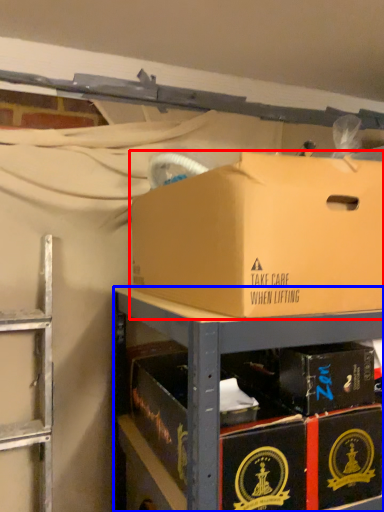
Question: Which object is closer to the camera taking this photo, box (highlighted by a red box) or shelf (highlighted by a blue box)?

Choices:
 (A) box
 (B) shelf

Answer: (A)